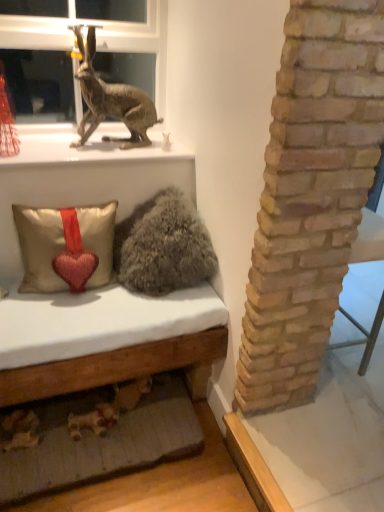
Question: From the image's perspective, is fuzzy gray pillow at center under satin beige pillow with heart at lower left?

Choices:
 (A) yes
 (B) no

Answer: (B)

Question: Can you confirm if fuzzy gray pillow at center is taller than satin beige pillow with heart at lower left?

Choices:
 (A) yes
 (B) no

Answer: (A)

Question: Does fuzzy gray pillow at center have a lesser height compared to satin beige pillow with heart at lower left?

Choices:
 (A) yes
 (B) no

Answer: (B)

Question: Is fuzzy gray pillow at center looking in the opposite direction of satin beige pillow with heart at lower left?

Choices:
 (A) no
 (B) yes

Answer: (A)

Question: Are fuzzy gray pillow at center and satin beige pillow with heart at lower left located far from each other?

Choices:
 (A) yes
 (B) no

Answer: (B)

Question: Considering the positions of metallic gold statue at upper left and fuzzy gray pillow at center in the image, is metallic gold statue at upper left wider or thinner than fuzzy gray pillow at center?

Choices:
 (A) thin
 (B) wide

Answer: (B)

Question: In terms of height, does metallic gold statue at upper left look taller or shorter compared to fuzzy gray pillow at center?

Choices:
 (A) short
 (B) tall

Answer: (A)

Question: Is metallic gold statue at upper left in front of or behind fuzzy gray pillow at center in the image?

Choices:
 (A) front
 (B) behind

Answer: (B)

Question: Do you think metallic gold statue at upper left is within fuzzy gray pillow at center, or outside of it?

Choices:
 (A) inside
 (B) outside

Answer: (B)

Question: In terms of width, does metallic rabbit at upper left look wider or thinner when compared to metallic rabbit at upper left?

Choices:
 (A) thin
 (B) wide

Answer: (A)

Question: Is metallic rabbit at upper left in front of or behind metallic rabbit at upper left in the image?

Choices:
 (A) behind
 (B) front

Answer: (A)

Question: Is metallic rabbit at upper left taller or shorter than metallic rabbit at upper left?

Choices:
 (A) tall
 (B) short

Answer: (A)

Question: Is point (165, 38) closer or farther from the camera than point (87, 73)?

Choices:
 (A) farther
 (B) closer

Answer: (A)

Question: Choose the correct answer: Is metallic rabbit at upper left inside fuzzy gray pillow at center or outside it?

Choices:
 (A) outside
 (B) inside

Answer: (A)

Question: Is point (125, 44) closer or farther from the camera than point (180, 272)?

Choices:
 (A) farther
 (B) closer

Answer: (A)